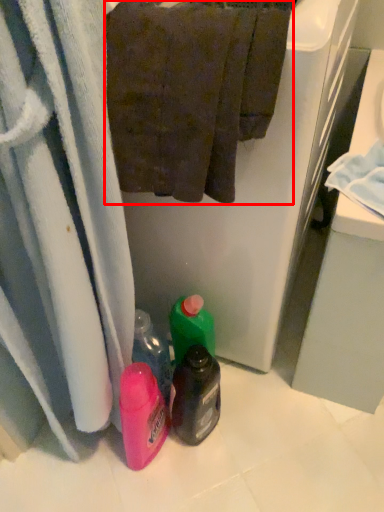
Question: From the image's perspective, considering the relative positions of towel (annotated by the red box) and bottle in the image provided, where is towel (annotated by the red box) located with respect to the staircase?

Choices:
 (A) above
 (B) below

Answer: (A)